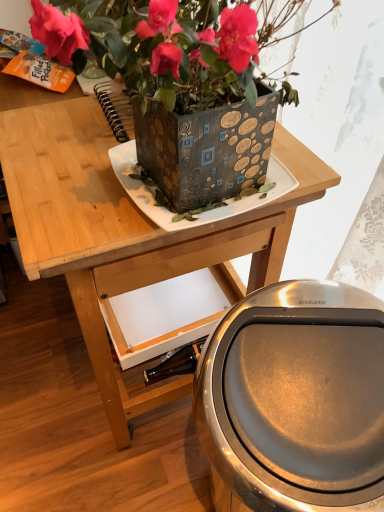
Question: Does metallic textured planter at upper center have a lesser height compared to polished stainless steel trash can at lower right?

Choices:
 (A) no
 (B) yes

Answer: (B)

Question: Is metallic textured planter at upper center behind polished stainless steel trash can at lower right?

Choices:
 (A) yes
 (B) no

Answer: (B)

Question: Is metallic textured planter at upper center positioned beyond the bounds of polished stainless steel trash can at lower right?

Choices:
 (A) yes
 (B) no

Answer: (A)

Question: From a real-world perspective, is metallic textured planter at upper center physically above polished stainless steel trash can at lower right?

Choices:
 (A) no
 (B) yes

Answer: (B)

Question: From the image's perspective, is metallic textured planter at upper center located above polished stainless steel trash can at lower right?

Choices:
 (A) no
 (B) yes

Answer: (B)

Question: Considering the relative sizes of metallic textured planter at upper center and polished stainless steel trash can at lower right in the image provided, is metallic textured planter at upper center thinner than polished stainless steel trash can at lower right?

Choices:
 (A) no
 (B) yes

Answer: (A)

Question: Considering the relative sizes of polished stainless steel trash can at lower right and metallic textured planter at upper center in the image provided, is polished stainless steel trash can at lower right taller than metallic textured planter at upper center?

Choices:
 (A) no
 (B) yes

Answer: (B)

Question: From a real-world perspective, is polished stainless steel trash can at lower right under metallic textured planter at upper center?

Choices:
 (A) yes
 (B) no

Answer: (A)

Question: Is polished stainless steel trash can at lower right far from metallic textured planter at upper center?

Choices:
 (A) no
 (B) yes

Answer: (A)

Question: Is polished stainless steel trash can at lower right at the left side of metallic textured planter at upper center?

Choices:
 (A) yes
 (B) no

Answer: (B)

Question: Is polished stainless steel trash can at lower right outside of metallic textured planter at upper center?

Choices:
 (A) yes
 (B) no

Answer: (A)

Question: From a real-world perspective, is polished stainless steel trash can at lower right physically above metallic textured planter at upper center?

Choices:
 (A) yes
 (B) no

Answer: (B)

Question: Could polished stainless steel trash can at lower right be considered to be inside wooden table at upper center?

Choices:
 (A) no
 (B) yes

Answer: (A)